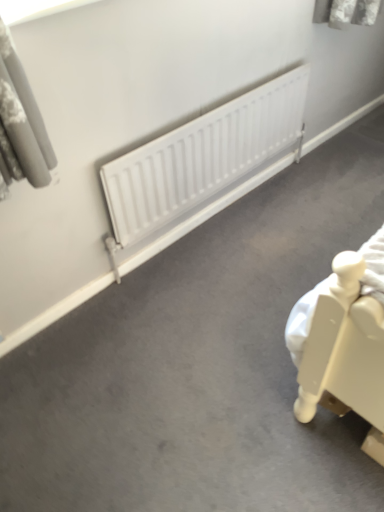
What are the coordinates of `vacant space underneath white matte radiator at center (from a real-world perspective)` in the screenshot? It's located at coord(216,218).